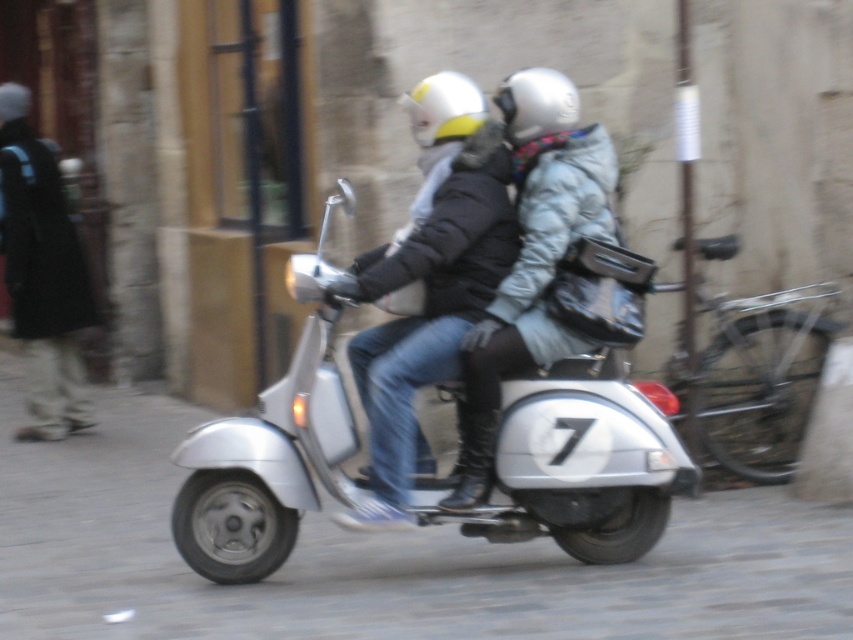
Does silver metallic scooter at center lie in front of white matte helmet at center?

Yes, it is.

Is point (338, 384) farther from camera compared to point (520, 109)?

No, it is in front of (520, 109).

Is point (239, 436) positioned before point (531, 92)?

Yes.

The width and height of the screenshot is (853, 640). In order to click on silver metallic scooter at center in this screenshot , I will do `click(576, 465)`.

Is white matte helmet at center taller than white matte helmet at upper center?

Indeed, white matte helmet at center has a greater height compared to white matte helmet at upper center.

Who is positioned more to the left, white matte helmet at center or white matte helmet at upper center?

From the viewer's perspective, white matte helmet at upper center appears more on the left side.

Between point (521, 129) and point (413, 93), which one is positioned in front?

Point (521, 129)

Find the location of a particular element. white matte helmet at center is located at coordinates (537, 104).

Between point (473, 214) and point (418, 106), which one is positioned behind?

The point (418, 106) is behind.

Image resolution: width=853 pixels, height=640 pixels. Describe the element at coordinates (469, 264) in the screenshot. I see `metallic silver scooter at center` at that location.

Locate an element on the screen. metallic silver scooter at center is located at coordinates (469, 264).